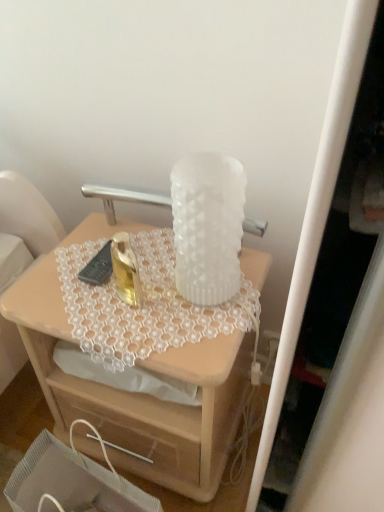
You are a GUI agent. You are given a task and a screenshot of the screen. Output one action in this format:
    pyautogui.click(x=<x>, y=<y>)
    Task: Click on the vacant space in front of white frosted vase at center
    The image size is (384, 512).
    Given the screenshot: What is the action you would take?
    pyautogui.click(x=195, y=330)